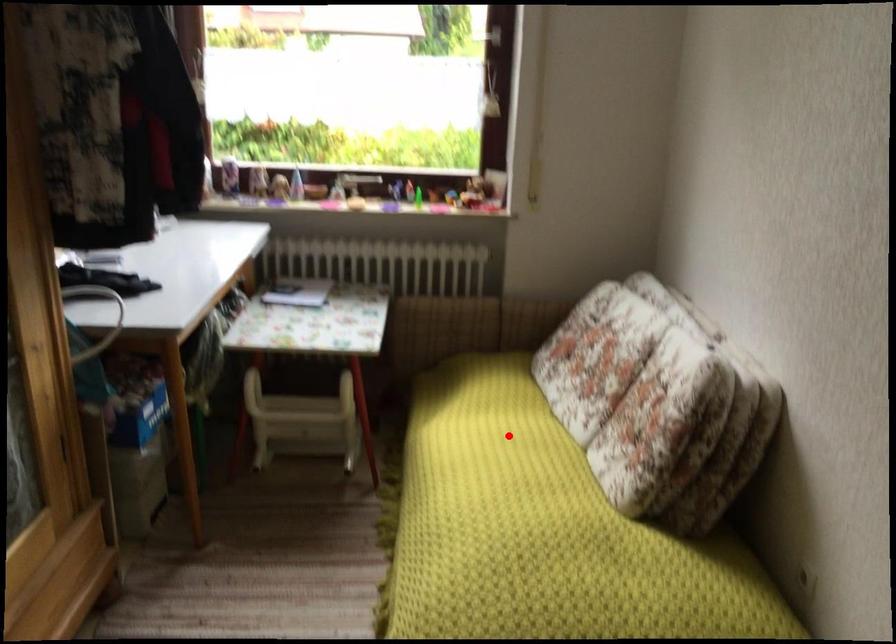
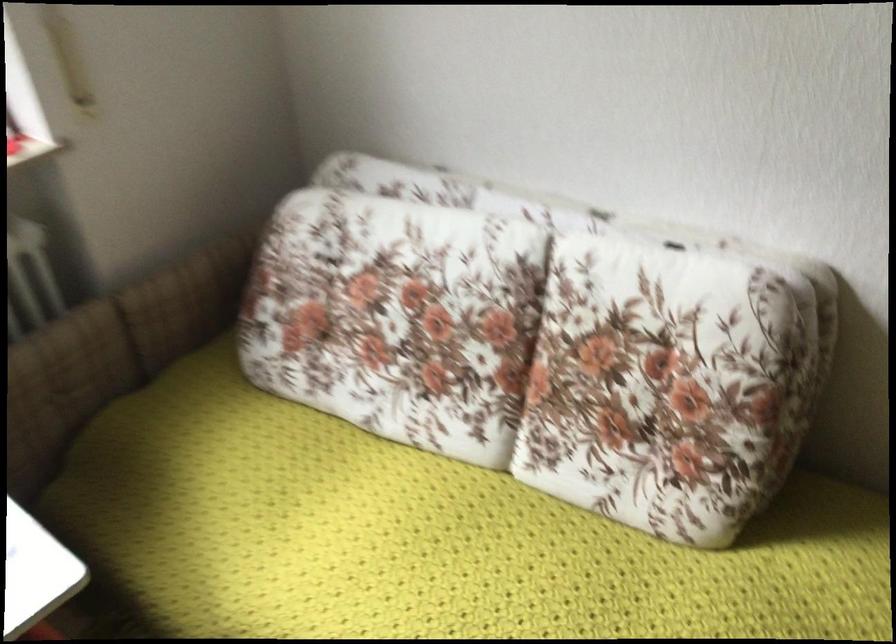
Locate, in the second image, the point that corresponds to the highlighted location in the first image.

(429, 538)